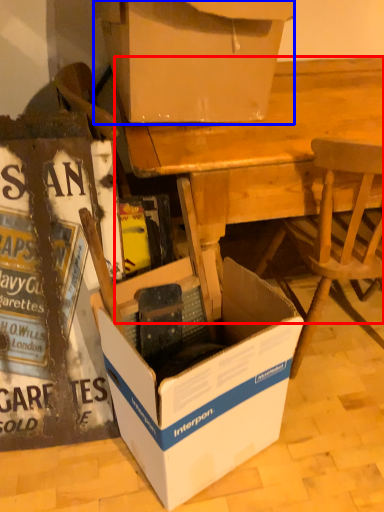
Question: Among these objects, which one is farthest to the camera, desk (highlighted by a red box) or box (highlighted by a blue box)?

Choices:
 (A) desk
 (B) box

Answer: (A)